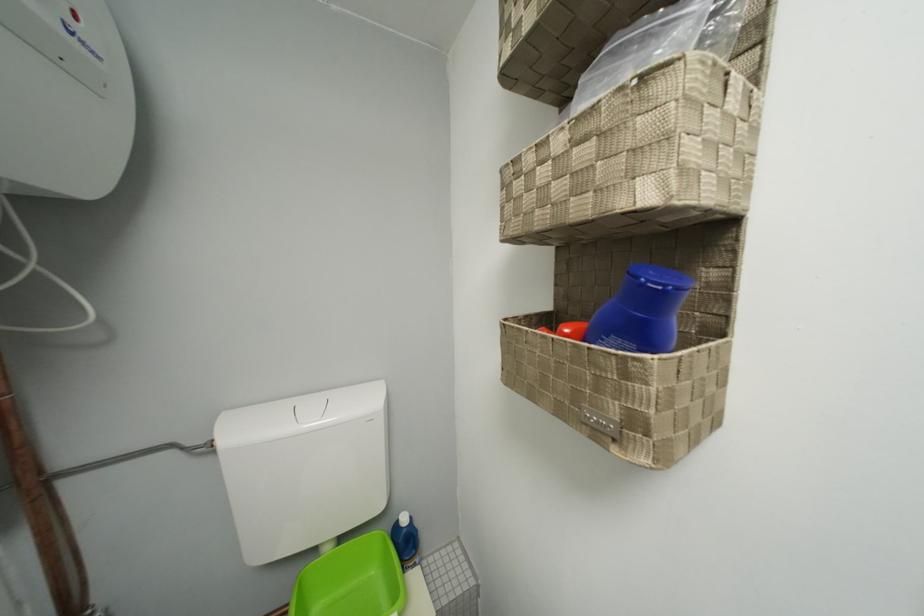
Where would you lift the green plastic tub? Please return your answer as a coordinate pair (x, y).

(351, 580)